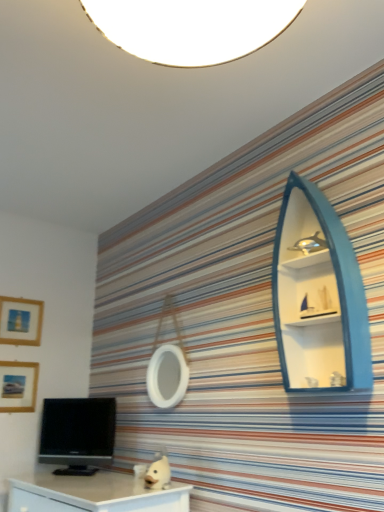
Question: From the image's perspective, is matte gold picture frame at upper left, the second picture frame from the bottom, located above or below black glossy tv at lower left?

Choices:
 (A) below
 (B) above

Answer: (B)

Question: In terms of height, does matte gold picture frame at upper left, the second picture frame from the bottom, look taller or shorter compared to black glossy tv at lower left?

Choices:
 (A) short
 (B) tall

Answer: (A)

Question: Which object is positioned closest to the wooden matte picture frame at lower left, which ranks as the 2th picture frame in top-to-bottom order?

Choices:
 (A) teal wood boat-shaped shelf at upper right
 (B) black glossy tv at lower left
 (C) matte gold picture frame at upper left, positioned as the 1th picture frame in top-to-bottom order

Answer: (C)

Question: Estimate the real-world distances between objects in this image. Which object is farther from the wooden matte picture frame at lower left, the 1th picture frame when ordered from bottom to top?

Choices:
 (A) matte gold picture frame at upper left, the second picture frame from the bottom
 (B) black glossy tv at lower left
 (C) teal wood boat-shaped shelf at upper right

Answer: (C)